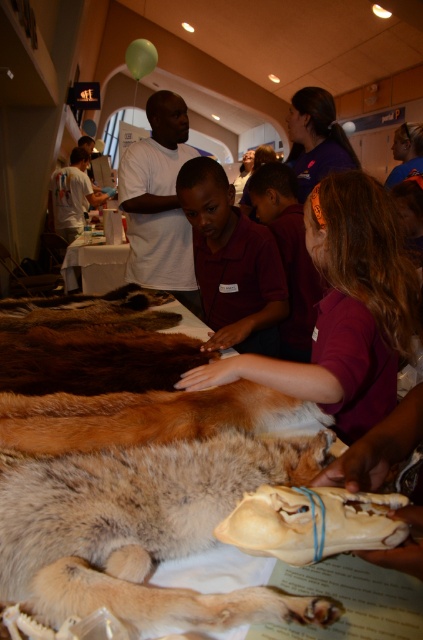
Can you confirm if purple shirt at center is shorter than white t-shirt at left?

Correct, purple shirt at center is not as tall as white t-shirt at left.

Is point (263, 321) positioned in front of point (65, 204)?

Yes, point (263, 321) is closer to viewer.

Is point (231, 244) more distant than point (82, 227)?

No, it is in front of (82, 227).

You are a GUI agent. You are given a task and a screenshot of the screen. Output one action in this format:
    pyautogui.click(x=<x>, y=<y>)
    Task: Click on the purple shirt at center
    
    Given the screenshot: What is the action you would take?
    pyautogui.click(x=231, y=262)

In the scene shown: Is fluffy fur dog at center taller than white t-shirt at left?

In fact, fluffy fur dog at center may be shorter than white t-shirt at left.

Is fluffy fur dog at center bigger than white t-shirt at left?

No, fluffy fur dog at center is not bigger than white t-shirt at left.

Is point (47, 600) closer to camera compared to point (54, 172)?

Yes, it is in front of point (54, 172).

You are a GUI agent. You are given a task and a screenshot of the screen. Output one action in this format:
    pyautogui.click(x=<x>, y=<y>)
    Task: Click on the fluffy fur dog at center
    Image resolution: width=423 pixels, height=640 pixels.
    Given the screenshot: What is the action you would take?
    pyautogui.click(x=142, y=529)

Who is more forward, (95,540) or (249,291)?

Point (95,540)

Is fluffy fur dog at center to the right of purple shirt at center from the viewer's perspective?

Incorrect, fluffy fur dog at center is not on the right side of purple shirt at center.

Which is in front, point (49, 474) or point (269, 282)?

Positioned in front is point (49, 474).

Locate an element on the screen. This screenshot has height=640, width=423. fluffy fur dog at center is located at coordinates (142, 529).